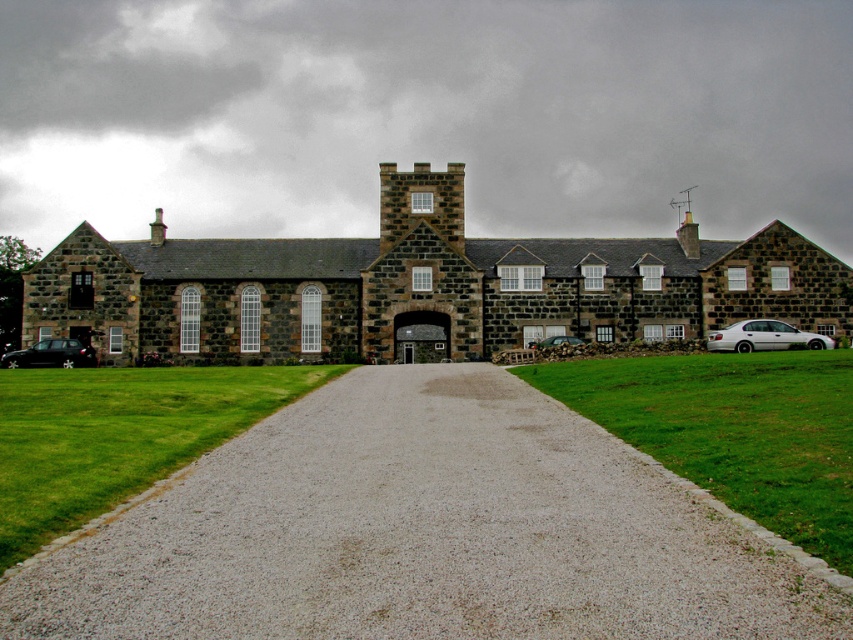
Does white metallic sedan at right have a lesser height compared to shiny black car at lower left?

Yes, white metallic sedan at right is shorter than shiny black car at lower left.

Who is taller, white metallic sedan at right or shiny black car at lower left?

shiny black car at lower left is taller.

What do you see at coordinates (763, 337) in the screenshot? This screenshot has width=853, height=640. I see `white metallic sedan at right` at bounding box center [763, 337].

In order to click on white metallic sedan at right in this screenshot , I will do `click(763, 337)`.

Describe the element at coordinates (421, 532) in the screenshot. I see `gray gravel at center` at that location.

Between point (486, 604) and point (550, 337), which one is positioned in front?

Point (486, 604)

Between point (438, 625) and point (575, 344), which one is positioned behind?

The point (575, 344) is behind.

Locate an element on the screen. This screenshot has width=853, height=640. gray gravel at center is located at coordinates (421, 532).

Between point (560, 586) and point (779, 336), which one is positioned in front?

Point (560, 586)

Which is above, gray gravel at center or white metallic sedan at right?

white metallic sedan at right is above.

The image size is (853, 640). What do you see at coordinates (421, 532) in the screenshot? I see `gray gravel at center` at bounding box center [421, 532].

At what (x,y) coordinates should I click in order to perform the action: click on gray gravel at center. Please return your answer as a coordinate pair (x, y). Looking at the image, I should click on (421, 532).